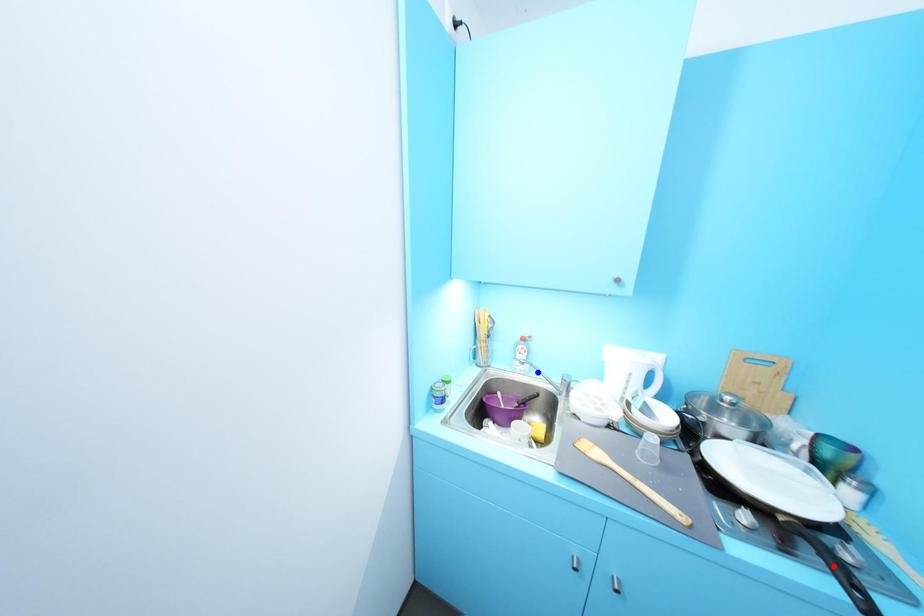
Question: Two points are marked on the image. Which point is closer to the camera?

Choices:
 (A) Blue point is closer.
 (B) Red point is closer.

Answer: (B)